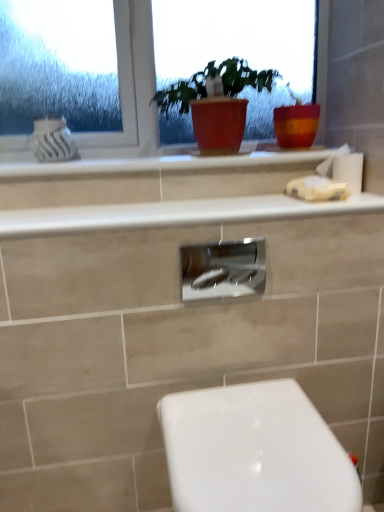
Question: Based on their positions, is white matte tissue at right located to the left or right of satin nickel faucet at center?

Choices:
 (A) left
 (B) right

Answer: (B)

Question: Considering the positions of white matte tissue at right and satin nickel faucet at center in the image, is white matte tissue at right bigger or smaller than satin nickel faucet at center?

Choices:
 (A) small
 (B) big

Answer: (B)

Question: Which of these objects is positioned farthest from the white matte tissue at right?

Choices:
 (A) white glossy toilet at lower right
 (B) clear glass window at upper center
 (C) satin nickel faucet at center
 (D) white glossy counter top at upper center, the 2th counter top viewed from the top
 (E) matte red pot at center

Answer: (A)

Question: Estimate the real-world distances between objects in this image. Which object is closer to the white glossy counter top at upper center, the 2th counter top viewed from the top?

Choices:
 (A) white glossy toilet at lower right
 (B) matte red pot at center
 (C) white glossy counter top at upper center, which ranks as the second counter top in bottom-to-top order
 (D) clear glass window at upper center
 (E) white matte tissue at right

Answer: (C)